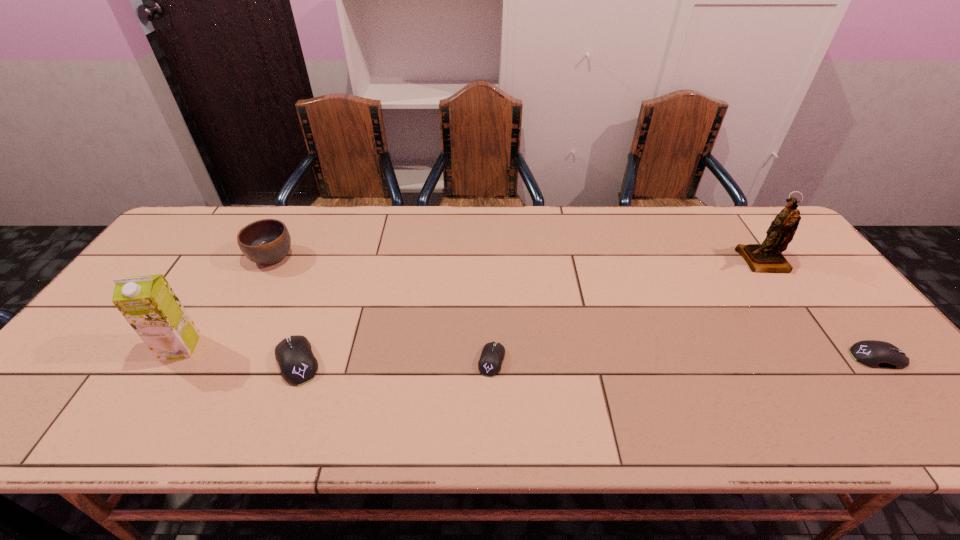
I want to click on vacant space that's between the shortest computer equipment and the figurine, so tap(628, 310).

Where is `vacant area between the rightmost computer equipment and the figurine`? vacant area between the rightmost computer equipment and the figurine is located at coordinates (821, 309).

Locate an element on the screen. vacant space that is in between the second shortest object and the leftmost computer equipment is located at coordinates (588, 359).

The height and width of the screenshot is (540, 960). I want to click on vacant area that lies between the soya milk and the second computer equipment from left to right, so click(x=336, y=354).

You are a GUI agent. You are given a task and a screenshot of the screen. Output one action in this format:
    pyautogui.click(x=<x>, y=<y>)
    Task: Click on the vacant area that lies between the bowl and the soya milk
    The height and width of the screenshot is (540, 960).
    Given the screenshot: What is the action you would take?
    pyautogui.click(x=226, y=302)

Identify which object is the third nearest to the bowl. Please provide its 2D coordinates. Your answer should be formatted as a tuple, i.e. [(x, y)], where the tuple contains the x and y coordinates of a point satisfying the conditions above.

[(489, 364)]

Identify which object is the nearest to the figurine. Please provide its 2D coordinates. Your answer should be formatted as a tuple, i.e. [(x, y)], where the tuple contains the x and y coordinates of a point satisfying the conditions above.

[(876, 354)]

Identify which computer equipment is located as the nearest to the soya milk. Please provide its 2D coordinates. Your answer should be formatted as a tuple, i.e. [(x, y)], where the tuple contains the x and y coordinates of a point satisfying the conditions above.

[(294, 355)]

Where is `computer equipment that is the closest to the third shortest object`? This screenshot has width=960, height=540. computer equipment that is the closest to the third shortest object is located at coordinates (489, 364).

In order to click on vacant space that satisfies the following two spatial constraints: 1. on the front-facing side of the figurine; 2. on the front side of the third object from left to right in this screenshot , I will do `click(834, 361)`.